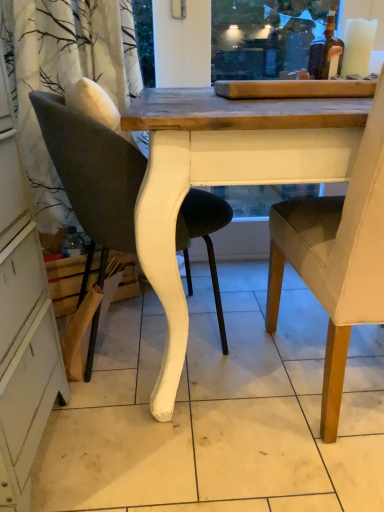
Find the location of a particular element. vacant space in front of white painted wood chair at left, the 2th chair viewed from the right is located at coordinates (162, 440).